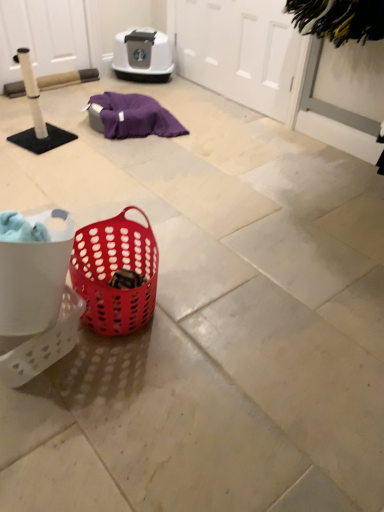
Question: Is white perforated basket at lower left wider than matte plastic basket at center?

Choices:
 (A) yes
 (B) no

Answer: (A)

Question: Is white perforated basket at lower left placed right next to matte plastic basket at center?

Choices:
 (A) yes
 (B) no

Answer: (B)

Question: From a real-world perspective, is white perforated basket at lower left physically below matte plastic basket at center?

Choices:
 (A) no
 (B) yes

Answer: (B)

Question: From a real-world perspective, is white perforated basket at lower left on top of matte plastic basket at center?

Choices:
 (A) yes
 (B) no

Answer: (B)

Question: Does white perforated basket at lower left appear on the right side of matte plastic basket at center?

Choices:
 (A) no
 (B) yes

Answer: (A)

Question: Is the depth of white perforated basket at lower left greater than that of matte plastic basket at center?

Choices:
 (A) yes
 (B) no

Answer: (B)

Question: Considering the relative positions of black fuzzy brush at upper right and matte plastic basket at center in the image provided, is black fuzzy brush at upper right to the left of matte plastic basket at center from the viewer's perspective?

Choices:
 (A) no
 (B) yes

Answer: (A)

Question: Does black fuzzy brush at upper right come behind matte plastic basket at center?

Choices:
 (A) no
 (B) yes

Answer: (B)

Question: Is black fuzzy brush at upper right thinner than matte plastic basket at center?

Choices:
 (A) yes
 (B) no

Answer: (B)

Question: Is black fuzzy brush at upper right not within matte plastic basket at center?

Choices:
 (A) yes
 (B) no

Answer: (A)

Question: Would you consider black fuzzy brush at upper right to be distant from matte plastic basket at center?

Choices:
 (A) yes
 (B) no

Answer: (A)

Question: From a real-world perspective, is black fuzzy brush at upper right beneath matte plastic basket at center?

Choices:
 (A) yes
 (B) no

Answer: (B)

Question: Does white perforated basket at lower left have a smaller size compared to white matte screen door at upper center, arranged as the 1th screen door when viewed from the right?

Choices:
 (A) no
 (B) yes

Answer: (B)